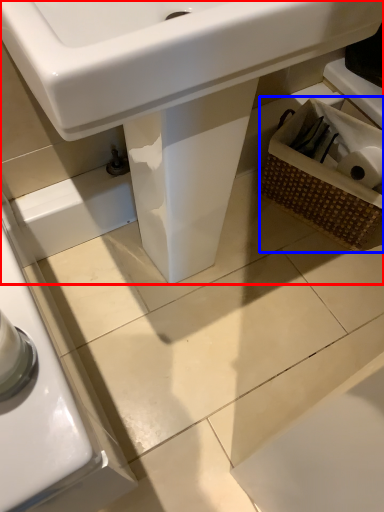
Question: Which object is closer to the camera taking this photo, sink (highlighted by a red box) or basket (highlighted by a blue box)?

Choices:
 (A) sink
 (B) basket

Answer: (A)